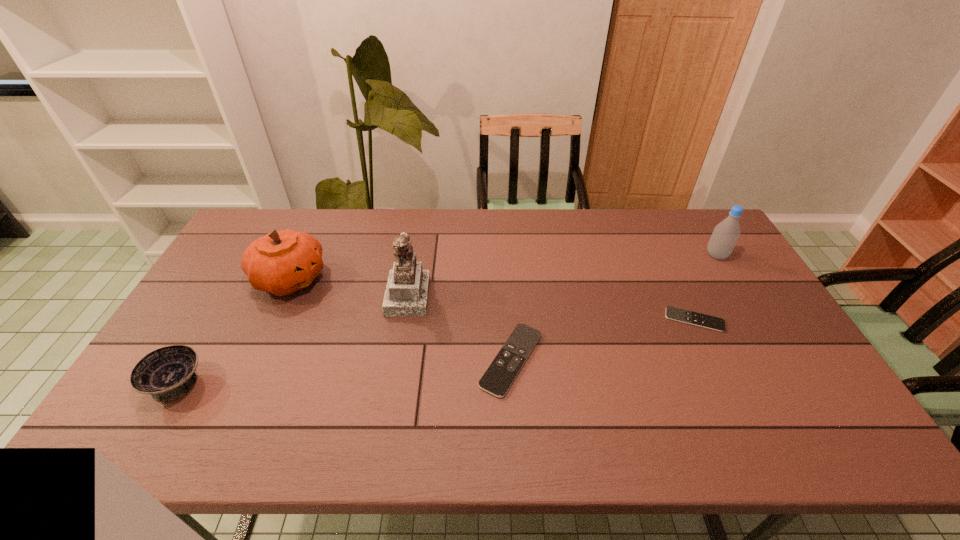
Find the location of a particular element. vacant space situated on the right of the shorter remote control is located at coordinates (771, 320).

This screenshot has height=540, width=960. Find the location of `vacant space situated 0.170m on the front-facing side of the pumpkin`. vacant space situated 0.170m on the front-facing side of the pumpkin is located at coordinates (381, 279).

Locate an element on the screen. vacant space situated 0.340m on the front-facing side of the tallest object is located at coordinates (540, 295).

In order to click on vacant area located 0.050m on the back of the rightmost object in this screenshot , I will do `click(707, 239)`.

Image resolution: width=960 pixels, height=540 pixels. I want to click on free space located 0.230m on the right of the fourth tallest object, so click(296, 383).

Where is `object located at the far edge`? object located at the far edge is located at coordinates (725, 235).

Where is `remote control that is at the near edge`? The image size is (960, 540). remote control that is at the near edge is located at coordinates (501, 373).

Where is `bowl located at the near edge`? The image size is (960, 540). bowl located at the near edge is located at coordinates pyautogui.click(x=167, y=373).

This screenshot has height=540, width=960. Identify the location of pumpkin positioned at the left edge. (283, 262).

Locate an element on the screen. bowl that is positioned at the left edge is located at coordinates click(x=167, y=373).